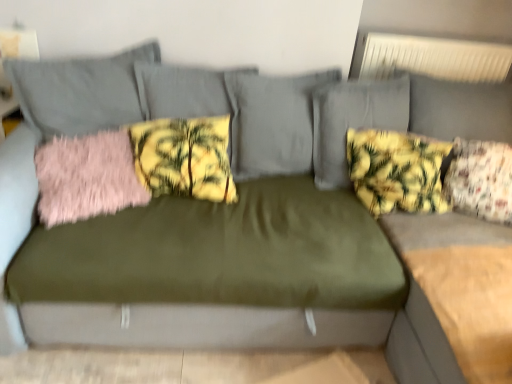
Question: From a real-world perspective, is floral fabric pillow at right, which ranks as the first pillow in right-to-left order, over yellow floral fabric pillow at upper right, which is the 3th pillow in left-to-right order?

Choices:
 (A) no
 (B) yes

Answer: (B)

Question: Is floral fabric pillow at right, which ranks as the first pillow in right-to-left order, at the right side of yellow floral fabric pillow at upper right, which is the 2th pillow from right to left?

Choices:
 (A) no
 (B) yes

Answer: (B)

Question: Does floral fabric pillow at right, which ranks as the first pillow in right-to-left order, appear on the left side of yellow floral fabric pillow at upper right, which is the 3th pillow in left-to-right order?

Choices:
 (A) no
 (B) yes

Answer: (A)

Question: Is floral fabric pillow at right, the 4th pillow in the left-to-right sequence, taller than yellow floral fabric pillow at upper right, which is the 3th pillow in left-to-right order?

Choices:
 (A) yes
 (B) no

Answer: (B)

Question: Could you tell me if floral fabric pillow at right, the 4th pillow in the left-to-right sequence, is facing yellow floral fabric pillow at upper right, which is the 3th pillow in left-to-right order?

Choices:
 (A) yes
 (B) no

Answer: (B)

Question: From a real-world perspective, is yellow floral fabric pillow at center, which appears as the second pillow when viewed from the left, physically located above or below pink fluffy pillow at left, the fourth pillow viewed from the right?

Choices:
 (A) above
 (B) below

Answer: (A)

Question: Is point (194, 168) positioned closer to the camera than point (120, 187)?

Choices:
 (A) closer
 (B) farther

Answer: (B)

Question: Relative to pink fluffy pillow at left, which is counted as the 1th pillow, starting from the left, is yellow floral fabric pillow at center, which appears as the second pillow when viewed from the left, in front or behind?

Choices:
 (A) behind
 (B) front

Answer: (A)

Question: Is yellow floral fabric pillow at center, which appears as the second pillow when viewed from the left, bigger or smaller than pink fluffy pillow at left, the fourth pillow viewed from the right?

Choices:
 (A) big
 (B) small

Answer: (A)

Question: Considering the positions of floral fabric pillow at right, the 4th pillow in the left-to-right sequence, and yellow floral fabric pillow at center, which is the 3th pillow in right-to-left order, in the image, is floral fabric pillow at right, the 4th pillow in the left-to-right sequence, bigger or smaller than yellow floral fabric pillow at center, which is the 3th pillow in right-to-left order,?

Choices:
 (A) big
 (B) small

Answer: (A)

Question: Is floral fabric pillow at right, which ranks as the first pillow in right-to-left order, taller or shorter than yellow floral fabric pillow at center, which appears as the second pillow when viewed from the left?

Choices:
 (A) short
 (B) tall

Answer: (B)

Question: In terms of width, does floral fabric pillow at right, which ranks as the first pillow in right-to-left order, look wider or thinner when compared to yellow floral fabric pillow at center, which is the 3th pillow in right-to-left order?

Choices:
 (A) thin
 (B) wide

Answer: (B)

Question: Would you say floral fabric pillow at right, the 4th pillow in the left-to-right sequence, is inside or outside yellow floral fabric pillow at center, which appears as the second pillow when viewed from the left?

Choices:
 (A) outside
 (B) inside

Answer: (A)

Question: Looking at their shapes, would you say yellow floral fabric pillow at upper right, which is the 3th pillow in left-to-right order, is wider or thinner than floral fabric pillow at right, the 4th pillow in the left-to-right sequence?

Choices:
 (A) wide
 (B) thin

Answer: (B)

Question: Relative to floral fabric pillow at right, which ranks as the first pillow in right-to-left order, is yellow floral fabric pillow at upper right, which is the 3th pillow in left-to-right order, in front or behind?

Choices:
 (A) front
 (B) behind

Answer: (B)